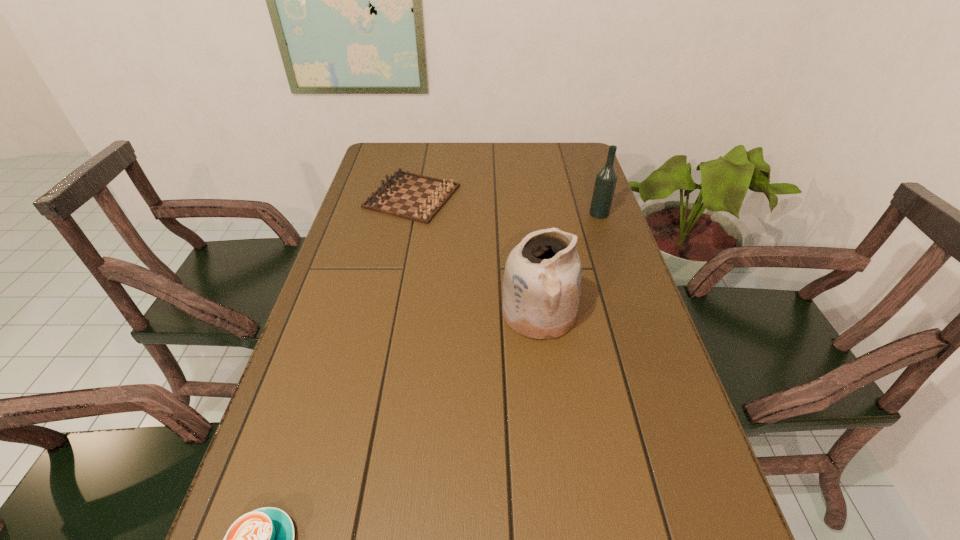
Where is `object located at the far left corner`? The height and width of the screenshot is (540, 960). object located at the far left corner is located at coordinates (415, 197).

Locate an element on the screen. free space at the far edge of the desktop is located at coordinates (500, 148).

Locate an element on the screen. free spot at the left edge of the desktop is located at coordinates (276, 435).

Locate an element on the screen. free space at the right edge of the desktop is located at coordinates (637, 480).

You are a GUI agent. You are given a task and a screenshot of the screen. Output one action in this format:
    pyautogui.click(x=<x>, y=<y>)
    Task: Click on the free space at the far left corner of the desktop
    
    Given the screenshot: What is the action you would take?
    pyautogui.click(x=384, y=148)

Find the location of a particular element. This screenshot has width=960, height=540. free space that is in between the second nearest object and the chessboard is located at coordinates (475, 255).

Where is `free area in between the chessboard and the pottery`? The image size is (960, 540). free area in between the chessboard and the pottery is located at coordinates (475, 255).

The height and width of the screenshot is (540, 960). Find the location of `vacant space that's between the chessboard and the vodka`. vacant space that's between the chessboard and the vodka is located at coordinates (506, 205).

Find the location of a particular element. This screenshot has width=960, height=540. vacant area between the chessboard and the vodka is located at coordinates (506, 205).

Where is `vacant space that's between the chessboard and the rightmost object`? Image resolution: width=960 pixels, height=540 pixels. vacant space that's between the chessboard and the rightmost object is located at coordinates (506, 205).